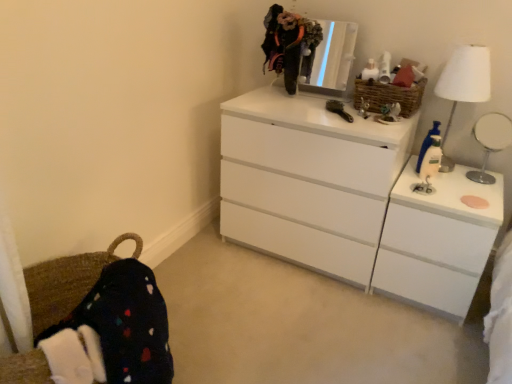
You are a GUI agent. You are given a task and a screenshot of the screen. Output one action in this format:
    pyautogui.click(x=<x>, y=<y>)
    Task: Click on the unoccupied area in front of white fabric lampshade at right
    
    Given the screenshot: What is the action you would take?
    pyautogui.click(x=465, y=187)